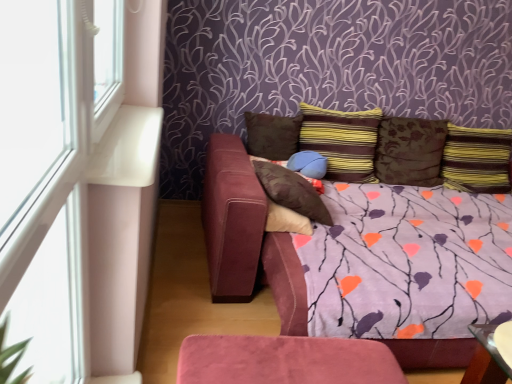
Question: Is transparent glass table at lower right with brown suede pillow at center, the 6th pillow from the right?

Choices:
 (A) yes
 (B) no

Answer: (B)

Question: Can you confirm if transparent glass table at lower right is bigger than brown suede pillow at center, which is the first pillow from left to right?

Choices:
 (A) no
 (B) yes

Answer: (A)

Question: Can you confirm if transparent glass table at lower right is shorter than brown suede pillow at center, which is the first pillow from left to right?

Choices:
 (A) no
 (B) yes

Answer: (B)

Question: Is brown suede pillow at center, which is the first pillow from left to right, located within transparent glass table at lower right?

Choices:
 (A) no
 (B) yes

Answer: (A)

Question: Is transparent glass table at lower right looking in the opposite direction of brown suede pillow at center, the 6th pillow from the right?

Choices:
 (A) yes
 (B) no

Answer: (B)

Question: From a real-world perspective, is transparent glass table at lower right beneath brown suede pillow at center, the 6th pillow from the right?

Choices:
 (A) yes
 (B) no

Answer: (A)

Question: Would you say suede-like purple couch at center is outside striped fabric pillow at center, acting as the 4th pillow starting from the left?

Choices:
 (A) yes
 (B) no

Answer: (A)

Question: From a real-world perspective, is suede-like purple couch at center below striped fabric pillow at center, acting as the 4th pillow starting from the left?

Choices:
 (A) no
 (B) yes

Answer: (B)

Question: Does suede-like purple couch at center have a larger size compared to striped fabric pillow at center, acting as the 4th pillow starting from the left?

Choices:
 (A) no
 (B) yes

Answer: (B)

Question: Considering the relative sizes of suede-like purple couch at center and striped fabric pillow at center, acting as the 4th pillow starting from the left, in the image provided, is suede-like purple couch at center thinner than striped fabric pillow at center, acting as the 4th pillow starting from the left,?

Choices:
 (A) no
 (B) yes

Answer: (A)

Question: From the image's perspective, would you say suede-like purple couch at center is shown under striped fabric pillow at center, acting as the 4th pillow starting from the left?

Choices:
 (A) no
 (B) yes

Answer: (B)

Question: Is striped fabric pillow at center, acting as the 4th pillow starting from the left, a part of suede-like purple couch at center?

Choices:
 (A) no
 (B) yes

Answer: (A)

Question: Is striped fabric pillow at upper right, marked as the 1th pillow in a right-to-left arrangement, a part of striped fabric pillow at center, arranged as the third pillow when viewed from the right?

Choices:
 (A) yes
 (B) no

Answer: (B)